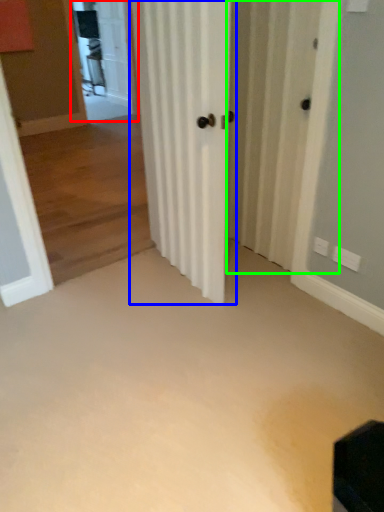
Question: Estimate the real-world distances between objects in this image. Which object is closer to screen door (highlighted by a red box), door (highlighted by a blue box) or screen door (highlighted by a green box)?

Choices:
 (A) door
 (B) screen door

Answer: (B)